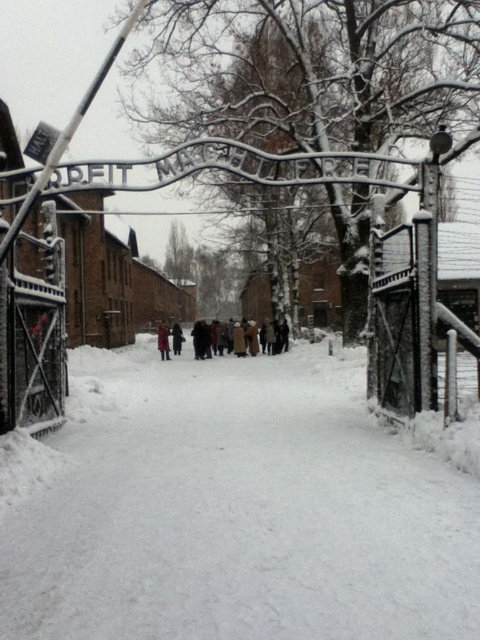
Based on the photo, who is positioned more to the right, brown wool coat at center or red wool coat at center?

brown wool coat at center is more to the right.

Does brown wool coat at center appear over red wool coat at center?

Correct, brown wool coat at center is located above red wool coat at center.

Find the location of `brown wool coat at center`. brown wool coat at center is located at coordinates (202, 337).

How distant is white powdery snow at center from red wool coat at center?

15.75 meters

The width and height of the screenshot is (480, 640). Describe the element at coordinates (237, 506) in the screenshot. I see `white powdery snow at center` at that location.

Which is in front, point (127, 525) or point (158, 342)?

Positioned in front is point (127, 525).

Image resolution: width=480 pixels, height=640 pixels. I want to click on white powdery snow at center, so click(237, 506).

Which is in front, point (96, 522) or point (165, 324)?

Point (96, 522) is in front.

Is point (452, 480) less distant than point (158, 330)?

That is True.

The width and height of the screenshot is (480, 640). Identify the location of white powdery snow at center. (237, 506).